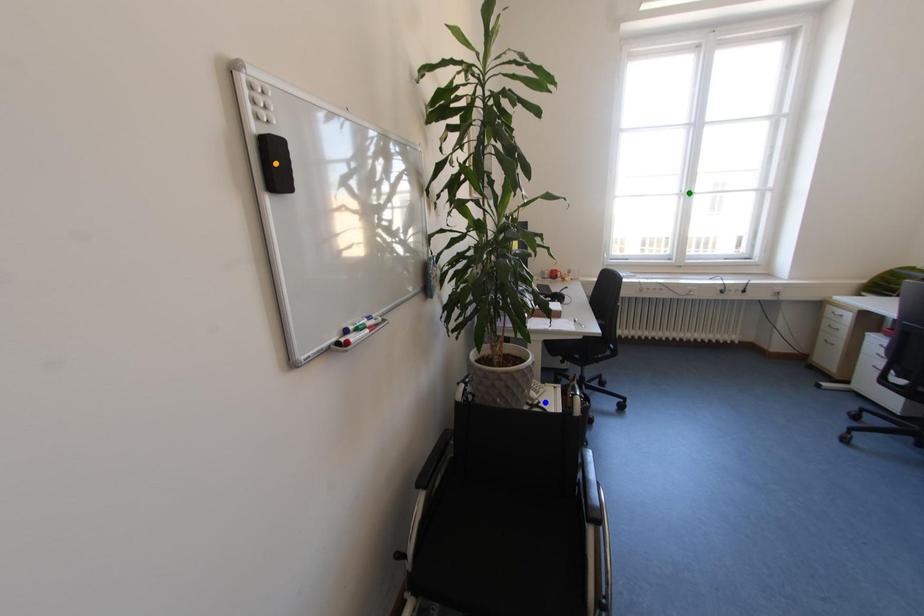
Order these from nearest to farthest:
blue point
green point
orange point

orange point → blue point → green point